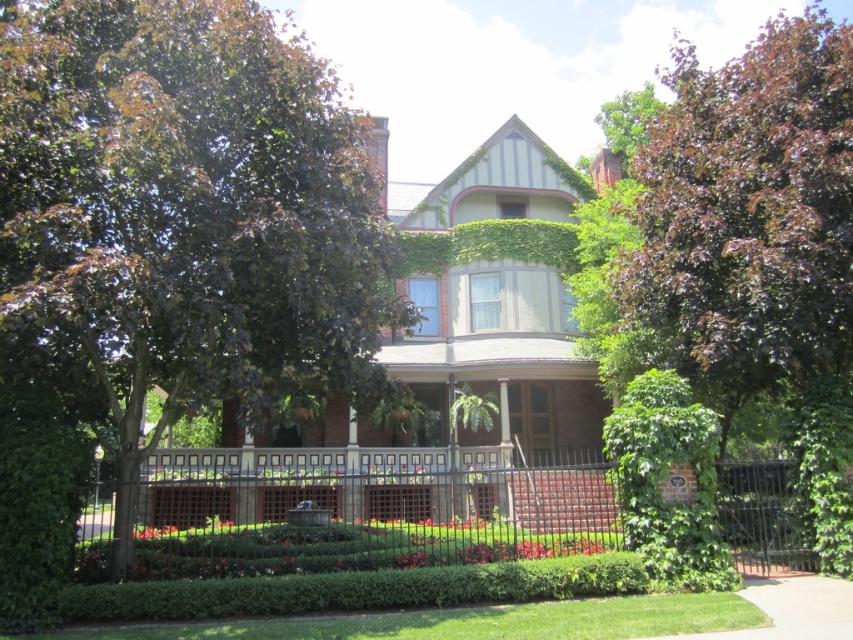
You are standing in front of the house and want to know which plant is taller between the dark green leafy tree at upper left and the green leafy bush at lower right. Can you tell me which one is taller?

The dark green leafy tree at upper left is taller than the green leafy bush at lower right according to the description.

You are standing in front of the house and want to determine the relative positions of two points marked in the garden. Which point is closer to you, point 1 at coordinates (733, 500) or point 2 at coordinates (688, 481)?

Point 1 at coordinates (733, 500) is closer to you because it is further to the viewer than point 2 at coordinates (688, 481).